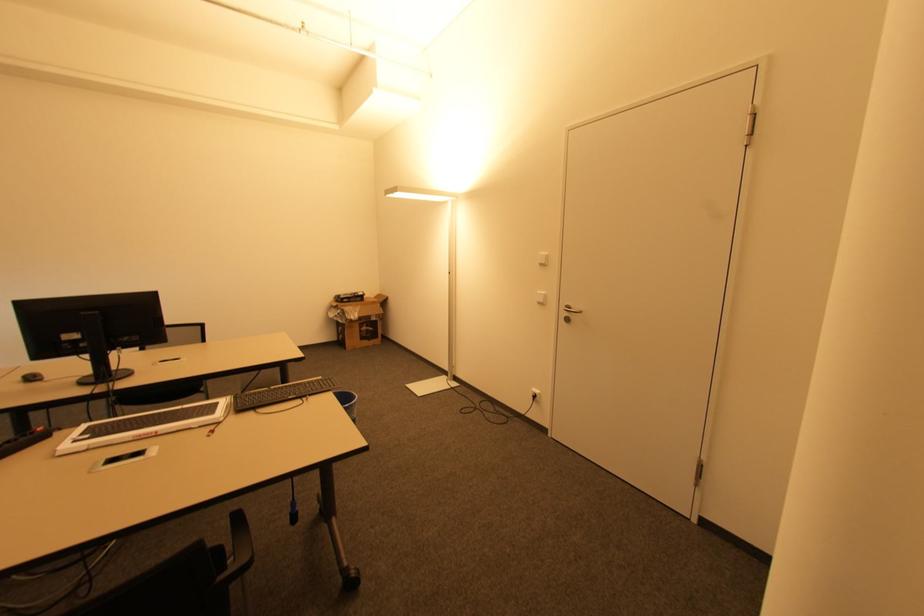
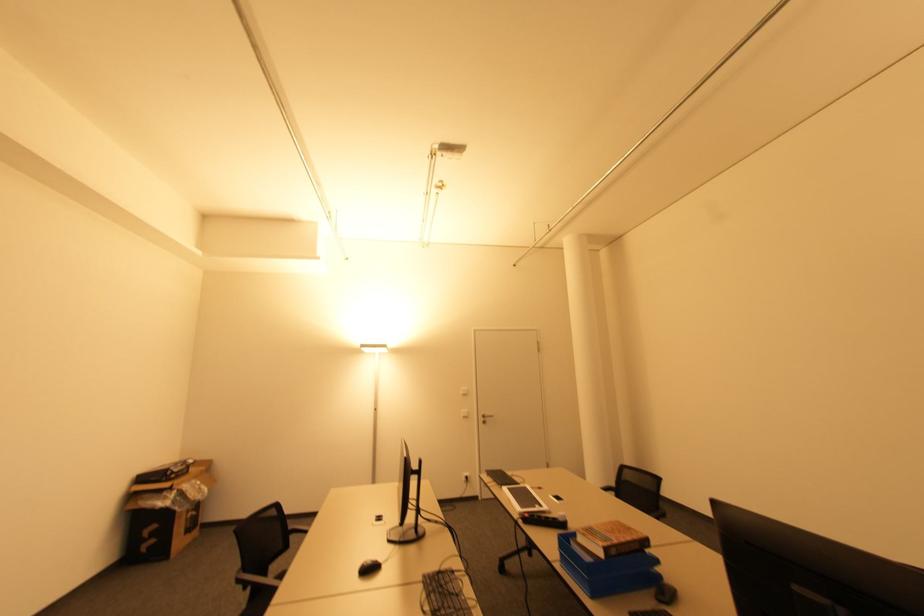
The point at (568, 320) is marked in the first image. Where is the corresponding point in the second image?

(485, 422)